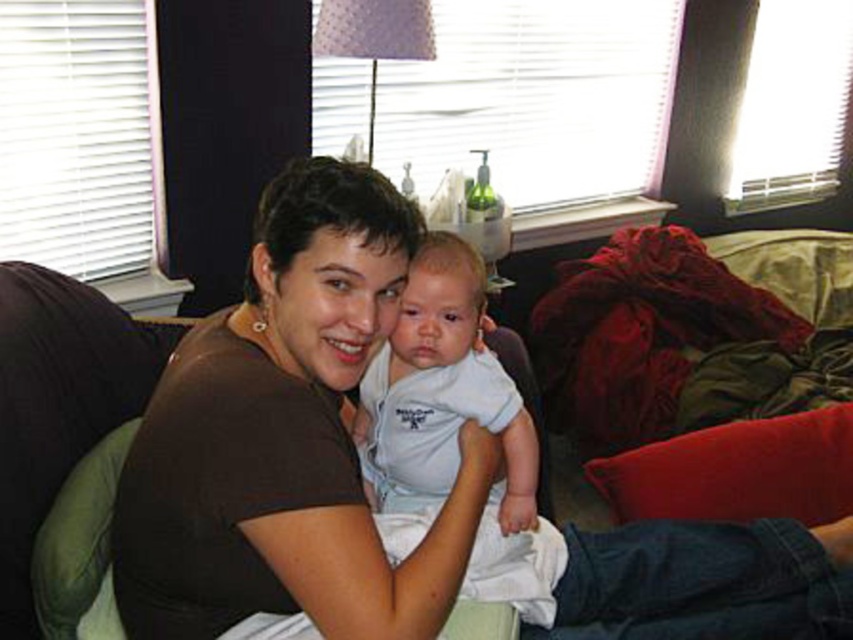
You are a photographer setting up for a family portrait in the living room. You notice two shirts hanging on the couch backrest. The brown matte shirt at center and the white cotton shirt at center. Which shirt is positioned lower on the couch backrest?

The brown matte shirt at center is located below the white cotton shirt at center, so the brown matte shirt at center is positioned lower on the couch backrest.

You are a fashion designer observing the two shirts in the image. The brown matte shirt at center and the white cotton shirt at center. Which one has a larger width?

The brown matte shirt at center is wider than the white cotton shirt at center according to the description.

Based on the photo, you are a photographer adjusting your camera to focus on the brown matte shirt at center and the white cotton shirt at center. Which shirt should you adjust your focus to first if you want to capture the closest one first?

The brown matte shirt at center is closer to the viewer than the white cotton shirt at center, so you should focus on the brown matte shirt at center first.